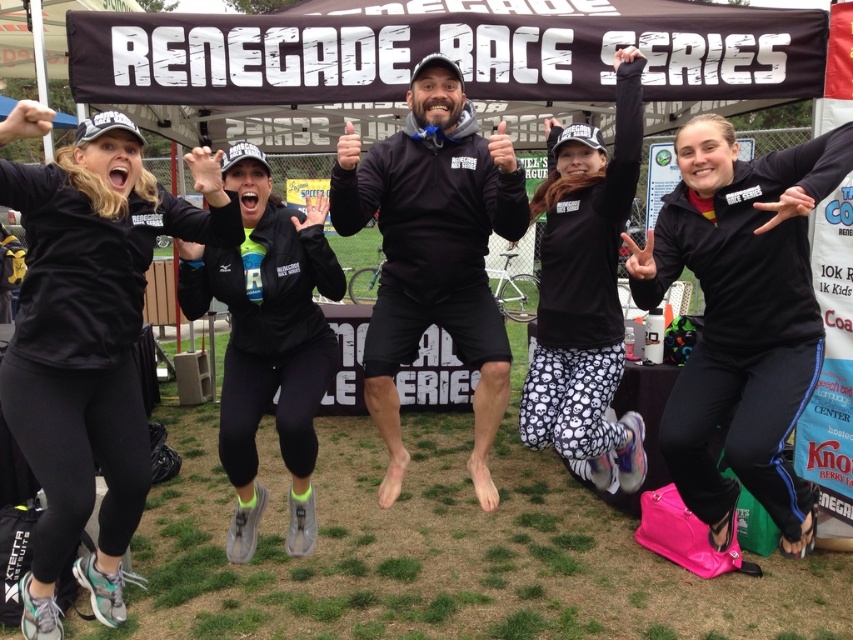
Question: From the image, what is the correct spatial relationship of matte black leggings at lower left in relation to white skull-pattern leggings at center?

Choices:
 (A) below
 (B) above

Answer: (A)

Question: Can you confirm if matte black leggings at lower left is positioned below black matte jacket at center?

Choices:
 (A) no
 (B) yes

Answer: (B)

Question: Among these objects, which one is farthest from the camera?

Choices:
 (A) matte black leggings at lower left
 (B) white skull-pattern leggings at center
 (C) black matte leggings at center

Answer: (B)

Question: Which is nearer to the matte black leggings at lower left?

Choices:
 (A) black matte leggings at center
 (B) black matte jacket at center
 (C) white skull-pattern leggings at center

Answer: (B)

Question: Can you confirm if matte black leggings at lower left is bigger than white skull-pattern leggings at center?

Choices:
 (A) yes
 (B) no

Answer: (A)

Question: Which is farther from the matte black leggings at lower left?

Choices:
 (A) black matte jacket at center
 (B) black matte hoodie at center
 (C) black matte leggings at center

Answer: (C)